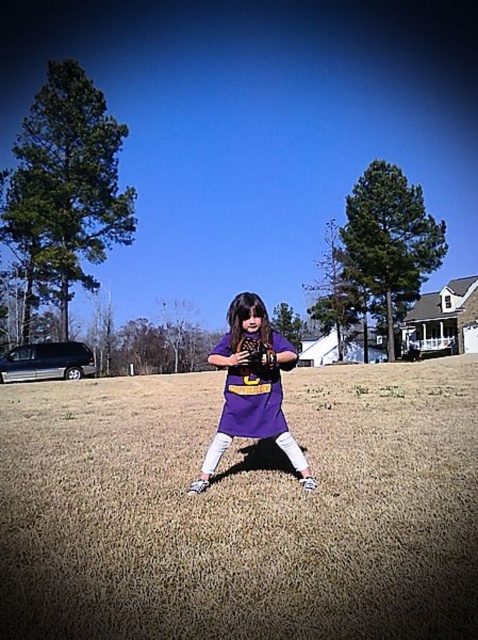
Question: Which object is farther from the camera taking this photo?

Choices:
 (A) brown dry grass at center
 (B) purple matte baseball glove at center

Answer: (B)

Question: Considering the relative positions of brown dry grass at center and black leather baseball glove at center in the image provided, where is brown dry grass at center located with respect to black leather baseball glove at center?

Choices:
 (A) below
 (B) above

Answer: (A)

Question: Which point is closer to the camera taking this photo?

Choices:
 (A) (258, 346)
 (B) (249, 360)

Answer: (B)

Question: Which point is farther to the camera?

Choices:
 (A) black leather baseball glove at center
 (B) brown dry grass at center

Answer: (A)

Question: Is brown dry grass at center wider than purple matte baseball glove at center?

Choices:
 (A) no
 (B) yes

Answer: (B)

Question: Can you confirm if brown dry grass at center is smaller than black leather baseball glove at center?

Choices:
 (A) no
 (B) yes

Answer: (A)